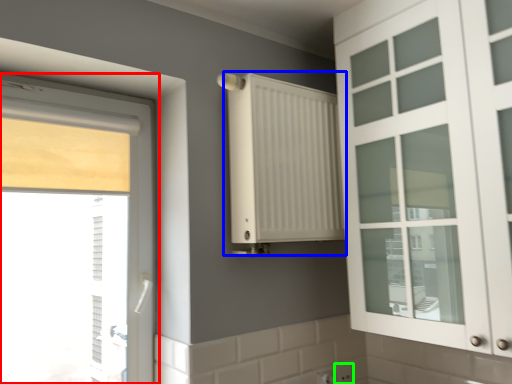
Question: Based on their relative distances, which object is farther from window (highlighted by a red box)? Choose from radiator (highlighted by a blue box) and electric outlet (highlighted by a green box).

Choices:
 (A) radiator
 (B) electric outlet

Answer: (B)